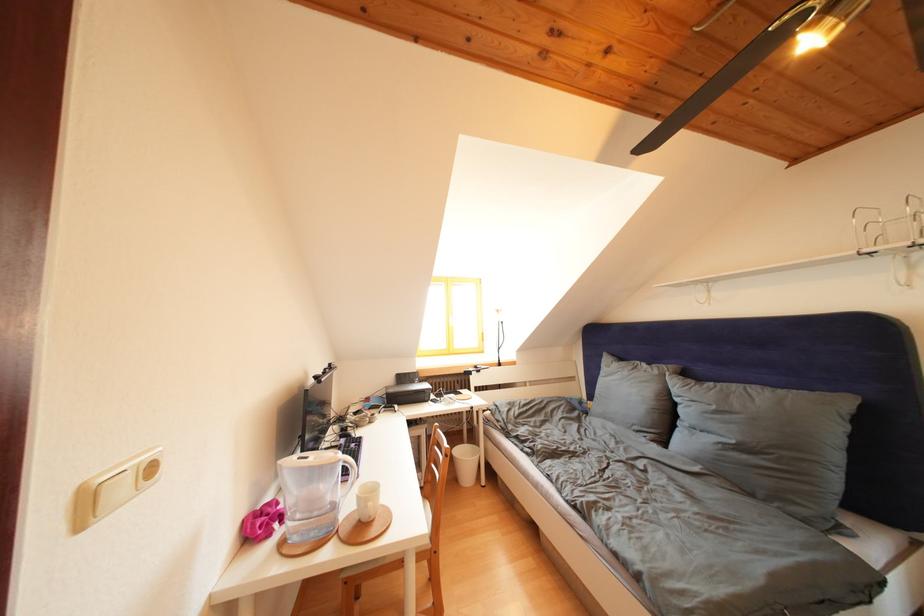
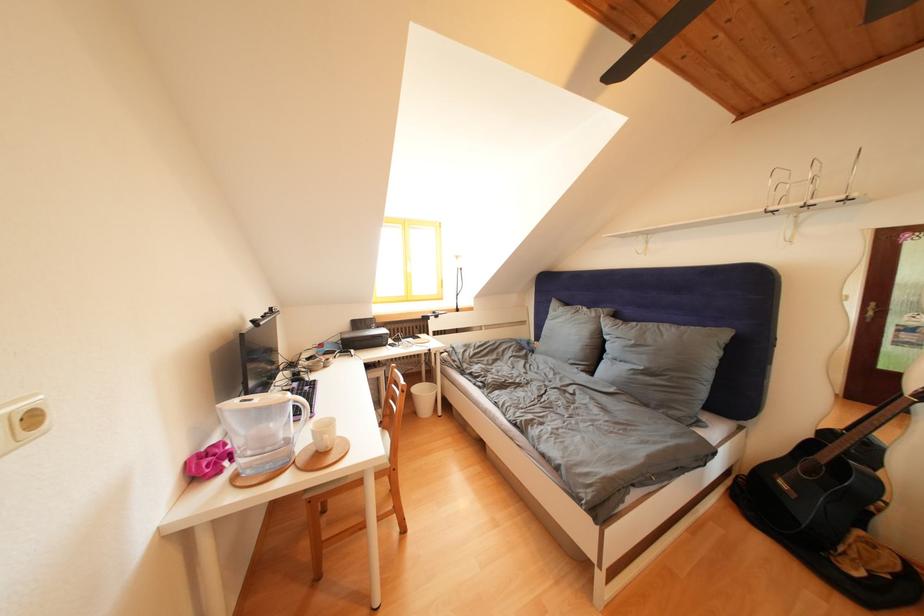
Find the pixel in the second image that matches (x=469, y=447) in the first image.

(429, 387)